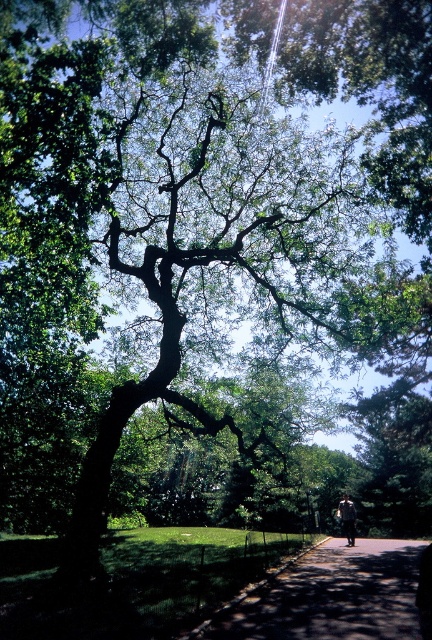
This screenshot has width=432, height=640. Find the location of `paved asphalt path at center`. paved asphalt path at center is located at coordinates (332, 596).

Image resolution: width=432 pixels, height=640 pixels. In order to click on paved asphalt path at center in this screenshot , I will do `click(332, 596)`.